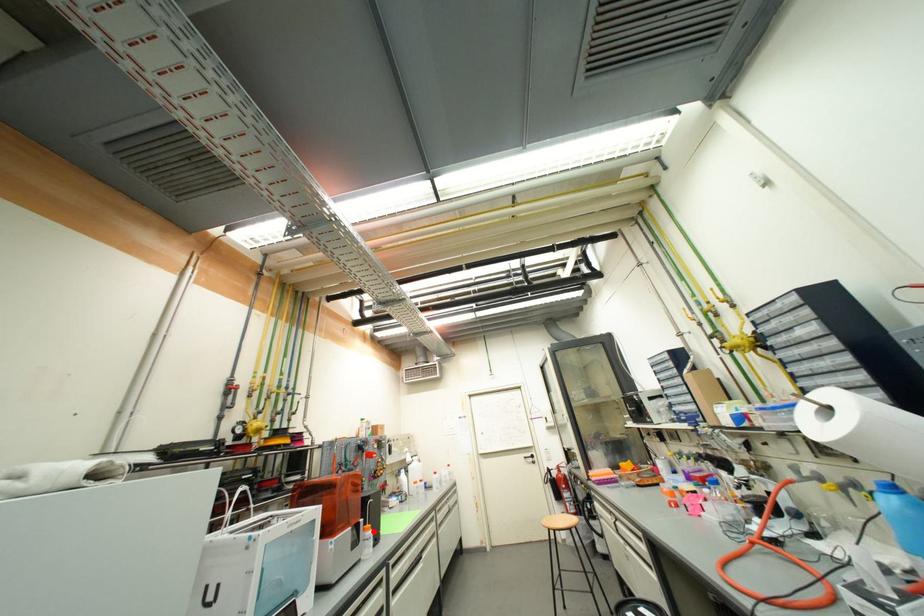
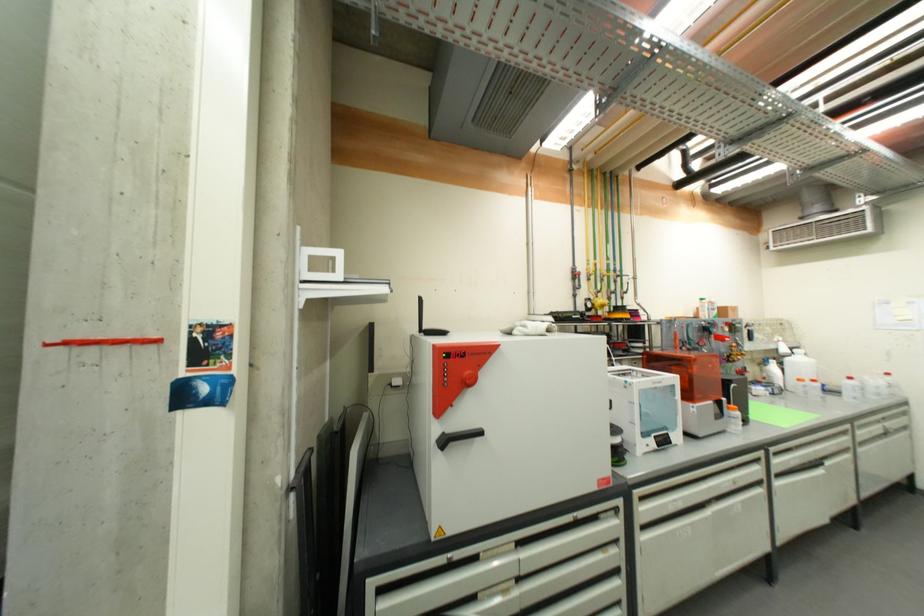
Find the pixel in the second image that matches the highlighted location in the first image.

(739, 411)